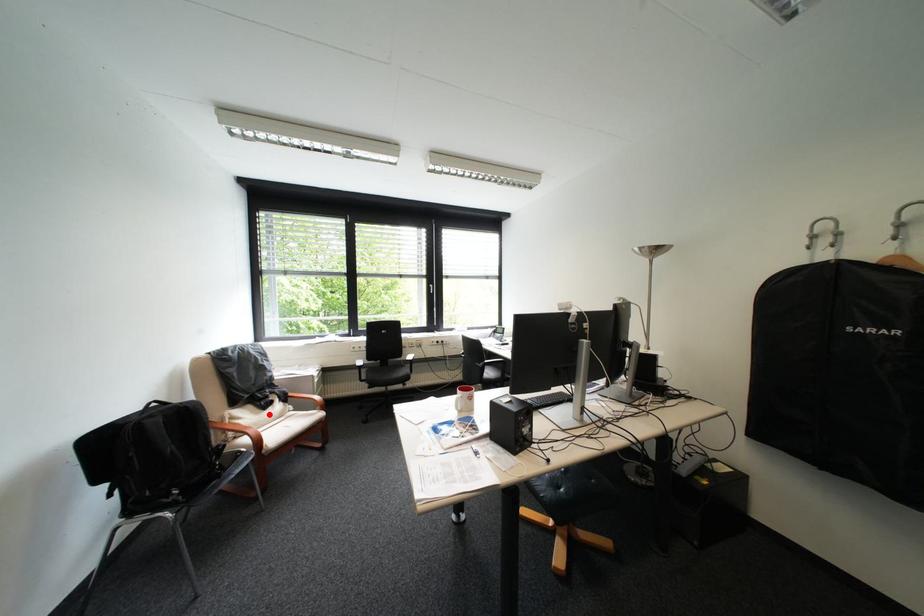
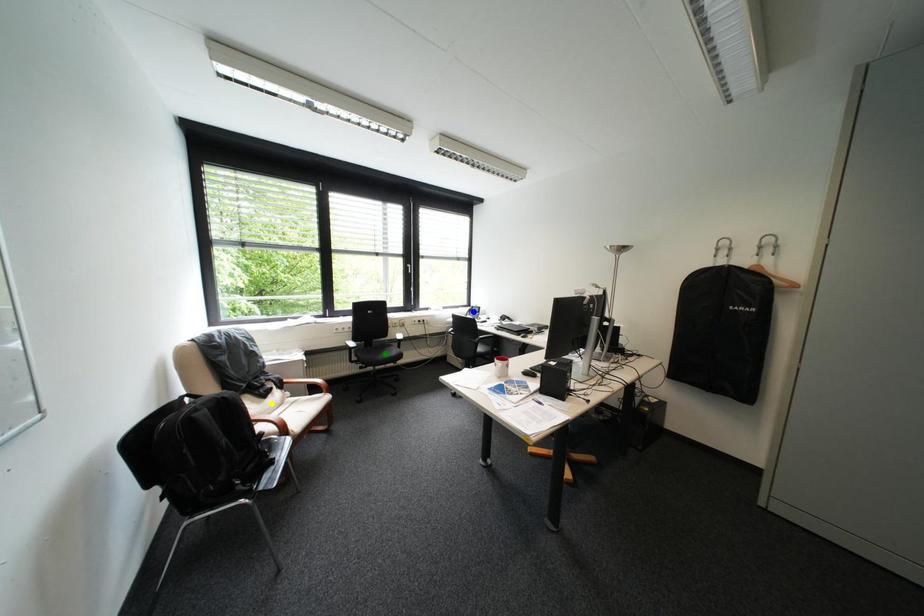
Question: I am providing you with two images of the same scene from different viewpoints. A red point is marked on the first image. You are given multiple points on the second image. Which point in image 2 represents the same 3d spot as the red point in image 1?

Choices:
 (A) blue point
 (B) yellow point
 (C) green point

Answer: (B)